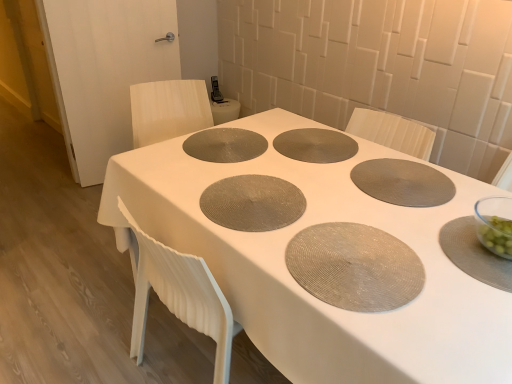
Locate an element on the screen. Image resolution: width=512 pixels, height=384 pixels. vacant area that lies between matte gray placemat at center, positioned as the 3th pizza pan in right-to-left order, and matte gray placemat at center right, marked as the first pizza pan in a right-to-left arrangement is located at coordinates (324, 190).